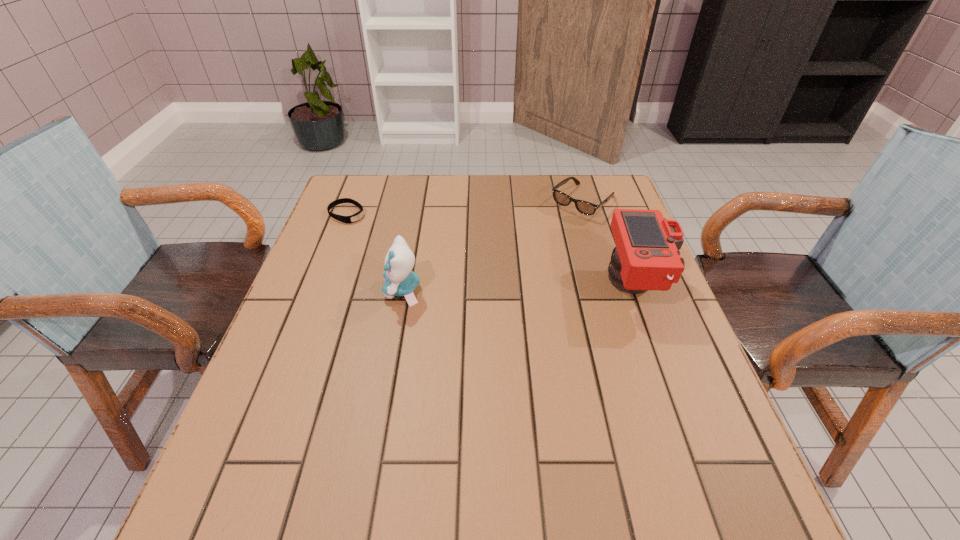
Where is `free space between the wristband and the spectacles`? Image resolution: width=960 pixels, height=540 pixels. free space between the wristband and the spectacles is located at coordinates (465, 208).

Identify the location of vacant point located between the kitten and the spectacles. This screenshot has width=960, height=540. (492, 246).

The width and height of the screenshot is (960, 540). In order to click on unoccupied position between the second shortest object and the leftmost object in this screenshot , I will do `click(465, 208)`.

In order to click on free area in between the second object from left to right and the spectacles in this screenshot , I will do `click(492, 246)`.

Find the location of a particular element. This screenshot has height=540, width=960. unoccupied area between the camera and the shortest object is located at coordinates (492, 249).

Where is `vacant region between the kitten and the spectacles`? This screenshot has width=960, height=540. vacant region between the kitten and the spectacles is located at coordinates (492, 246).

Locate an element on the screen. The height and width of the screenshot is (540, 960). unoccupied position between the kitten and the camera is located at coordinates (519, 288).

Identify the location of unoccupied area between the spectacles and the kitten. Image resolution: width=960 pixels, height=540 pixels. (492, 246).

Find the location of `object that can be found as the third closest to the shortest object`. object that can be found as the third closest to the shortest object is located at coordinates (646, 257).

The image size is (960, 540). Identify the location of object that is the second closest one to the wristband. (584, 207).